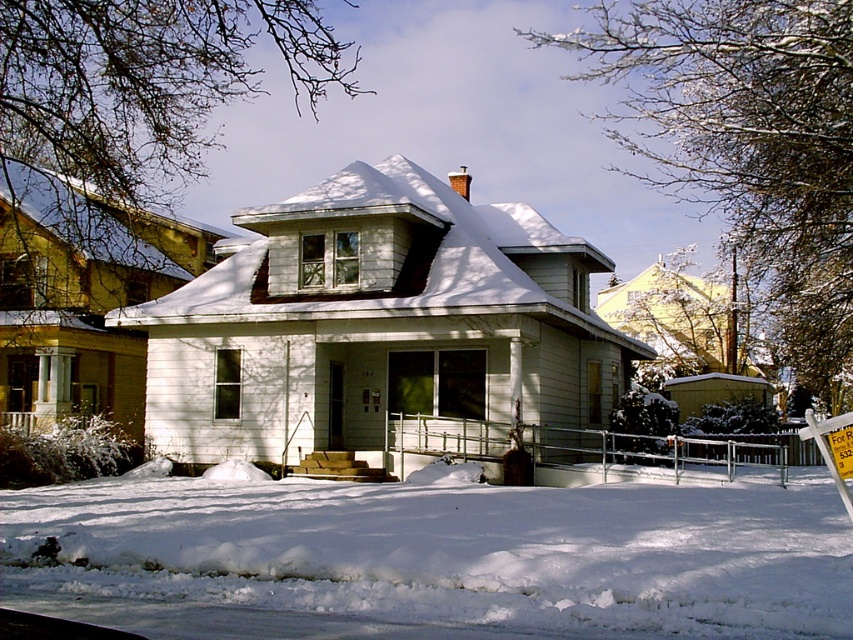
You are standing in front of the snowy house and see two points marked on the image. One is at point (86, 522) and the other at point (827, 467). Which point is closer to you?

Point (86, 522) is in front of point (827, 467), so it is closer to you.

You are standing in front of the house and want to place a small snowman exactly where the white fluffy snow at lower center is located. Can you confirm the exact coordinates where you should place it?

The white fluffy snow at lower center is located at point [456,550], so you should place the snowman there.

You are a mail carrier who needs to deliver a package to the house. You see the white fluffy snow at lower center and the white plastic sign at lower right. Which object is bigger in size?

The white fluffy snow at lower center is larger in size than the white plastic sign at lower right.